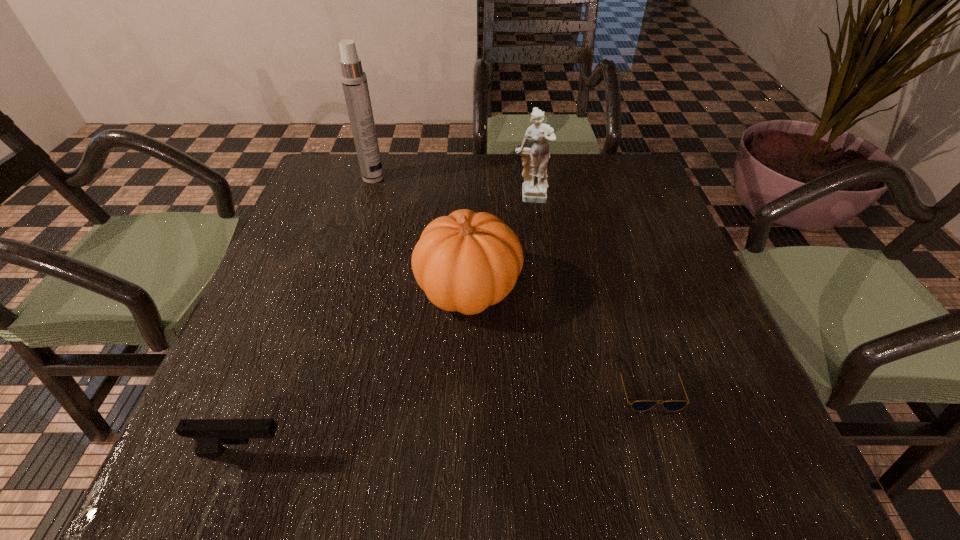
You are a GUI agent. You are given a task and a screenshot of the screen. Output one action in this format:
    pyautogui.click(x=<x>, y=<y>)
    Task: Click on the tallest object
    
    Given the screenshot: What is the action you would take?
    pyautogui.click(x=354, y=81)

Where is `the farthest object`? Image resolution: width=960 pixels, height=540 pixels. the farthest object is located at coordinates (354, 81).

You are a GUI agent. You are given a task and a screenshot of the screen. Output one action in this format:
    pyautogui.click(x=<x>, y=<y>)
    Task: Click on the fourth nearest object
    
    Given the screenshot: What is the action you would take?
    pyautogui.click(x=535, y=159)

Image resolution: width=960 pixels, height=540 pixels. I want to click on the second tallest object, so coord(535,159).

Locate an element on the screen. This screenshot has width=960, height=540. the third shortest object is located at coordinates (466, 261).

Find the location of `pumpkin`. pumpkin is located at coordinates (466, 261).

Locate an element on the screen. the nearest object is located at coordinates (210, 435).

Where is `the fourth tallest object`? the fourth tallest object is located at coordinates (210, 435).

Where is `the second nearest object`? The image size is (960, 540). the second nearest object is located at coordinates click(x=642, y=405).

This screenshot has width=960, height=540. Identify the location of the rightmost object. (642, 405).